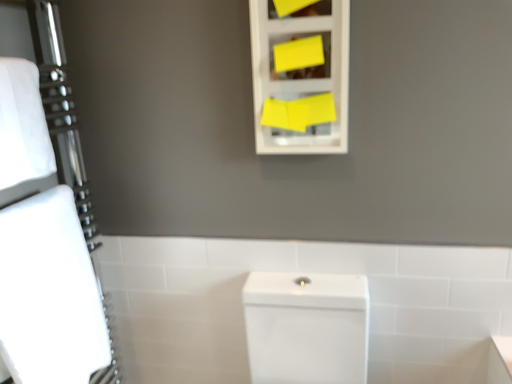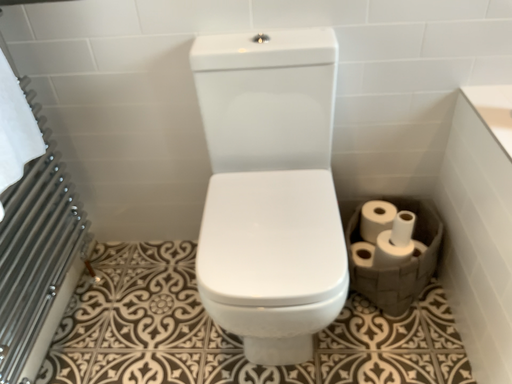
Question: How did the camera likely rotate when shooting the video?

Choices:
 (A) rotated left
 (B) rotated right

Answer: (B)